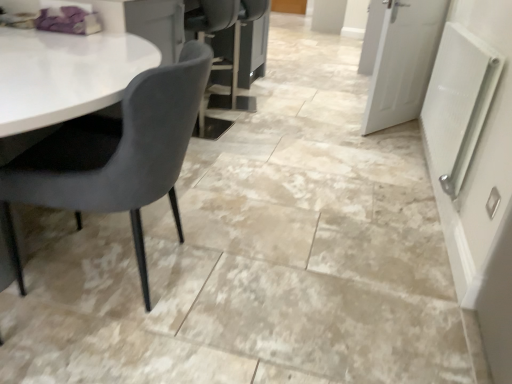
Question: Considering the relative sizes of velvet grey chair at left and white matte door at upper right, the 1th door positioned from the front, in the image provided, is velvet grey chair at left shorter than white matte door at upper right, the 1th door positioned from the front,?

Choices:
 (A) no
 (B) yes

Answer: (B)

Question: Does velvet grey chair at left appear on the right side of white matte door at upper right, positioned as the second door in top-to-bottom order?

Choices:
 (A) no
 (B) yes

Answer: (A)

Question: Does velvet grey chair at left come behind white matte door at upper right, positioned as the second door in top-to-bottom order?

Choices:
 (A) no
 (B) yes

Answer: (A)

Question: Considering the relative sizes of velvet grey chair at left and white matte door at upper right, the 1th door positioned from the front, in the image provided, is velvet grey chair at left bigger than white matte door at upper right, the 1th door positioned from the front,?

Choices:
 (A) no
 (B) yes

Answer: (B)

Question: From the image's perspective, would you say velvet grey chair at left is positioned over white matte door at upper right, which ranks as the first door in bottom-to-top order?

Choices:
 (A) yes
 (B) no

Answer: (B)

Question: In terms of size, does white painted wood door at upper right, the first door from the top, appear bigger or smaller than velvet grey chair at left?

Choices:
 (A) big
 (B) small

Answer: (A)

Question: From a real-world perspective, is white painted wood door at upper right, which is the second door in front-to-back order, above or below velvet grey chair at left?

Choices:
 (A) below
 (B) above

Answer: (A)

Question: From the image's perspective, relative to velvet grey chair at left, is white painted wood door at upper right, the first door from the top, above or below?

Choices:
 (A) below
 (B) above

Answer: (B)

Question: Considering the positions of white painted wood door at upper right, the second door from the bottom, and velvet grey chair at left in the image, is white painted wood door at upper right, the second door from the bottom, taller or shorter than velvet grey chair at left?

Choices:
 (A) tall
 (B) short

Answer: (B)

Question: Is velvet grey chair at left to the left or to the right of white textured radiator at right in the image?

Choices:
 (A) left
 (B) right

Answer: (A)

Question: From a real-world perspective, relative to white textured radiator at right, is velvet grey chair at left vertically above or below?

Choices:
 (A) below
 (B) above

Answer: (A)

Question: Considering the positions of velvet grey chair at left and white textured radiator at right in the image, is velvet grey chair at left bigger or smaller than white textured radiator at right?

Choices:
 (A) small
 (B) big

Answer: (B)

Question: In the image, is velvet grey chair at left positioned in front of or behind white textured radiator at right?

Choices:
 (A) front
 (B) behind

Answer: (A)

Question: Would you say white textured radiator at right is to the left or to the right of velvet grey chair at left in the picture?

Choices:
 (A) right
 (B) left

Answer: (A)

Question: From the image's perspective, is white textured radiator at right positioned above or below velvet grey chair at left?

Choices:
 (A) above
 (B) below

Answer: (A)